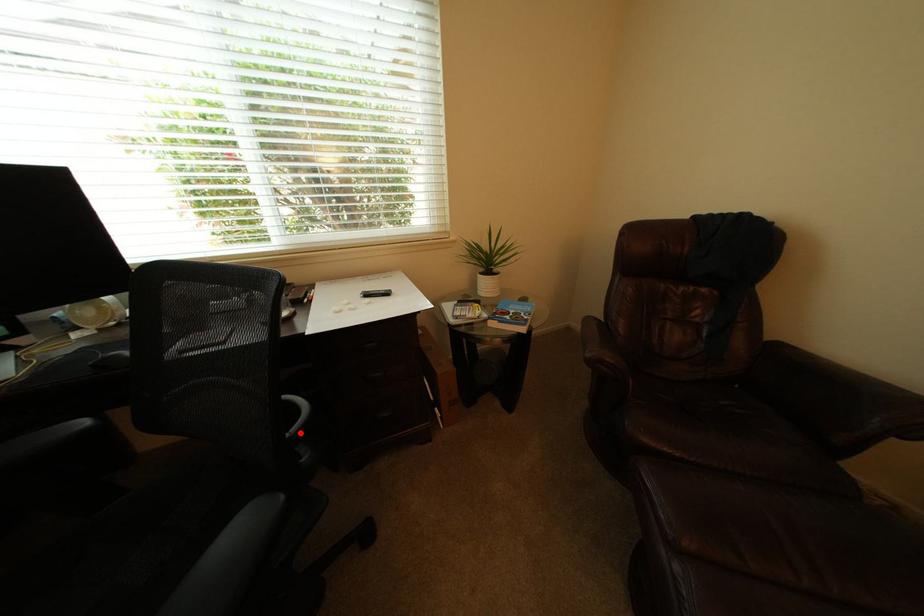
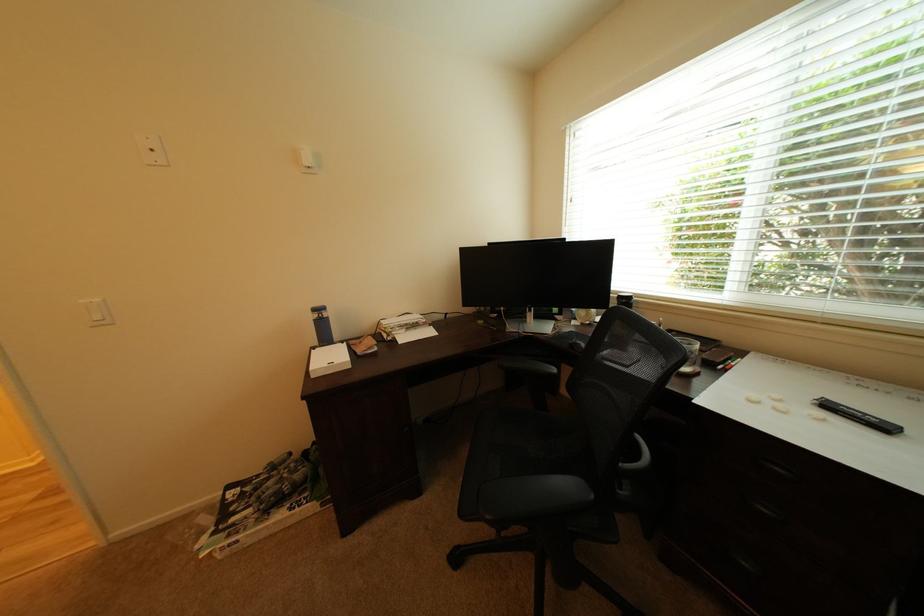
The point at the highlighted location is marked in the first image. Where is the corresponding point in the second image?

(636, 466)